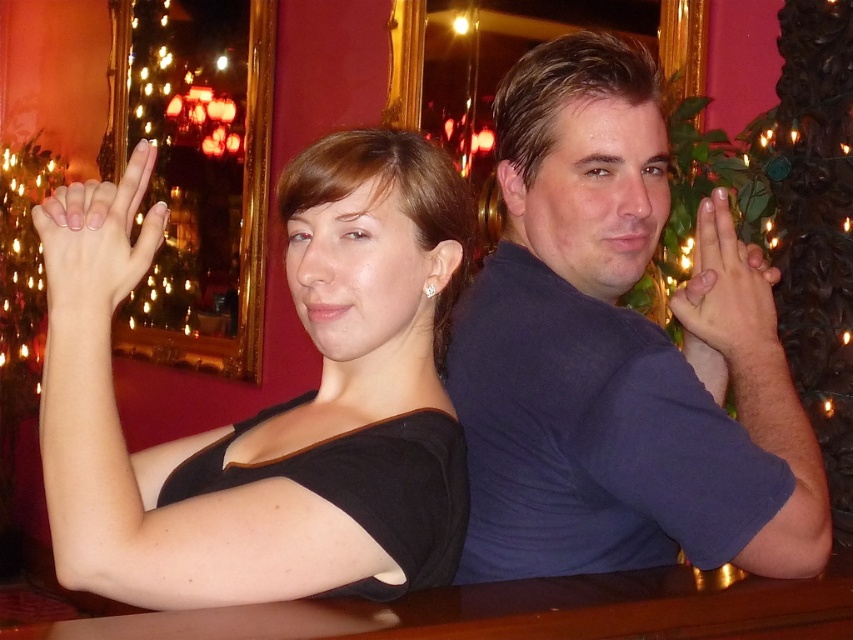
You are a photographer trying to capture a candid shot of the matte black top at left and the smooth skin hand at upper right. Which object is positioned lower in the frame?

The matte black top at left is located below the smooth skin hand at upper right, so the matte black top at left is positioned lower in the frame.

You are a photographer trying to capture a closeup shot of the dark blue shirt at center and the smooth skin hand at upper right. Which object should you zoom in on first to ensure both are in focus?

The dark blue shirt at center is larger in size than the smooth skin hand at upper right, so you should zoom in on the dark blue shirt at center first to ensure both are in focus.

You are a photographer trying to capture a closeup of the matte black top at left and the white polished nails at upper left. Which object should you zoom in on to ensure both are in focus without moving the camera?

The matte black top at left is larger in size compared to the white polished nails at upper left, so you should zoom in on the matte black top at left to ensure both are in focus without moving the camera.